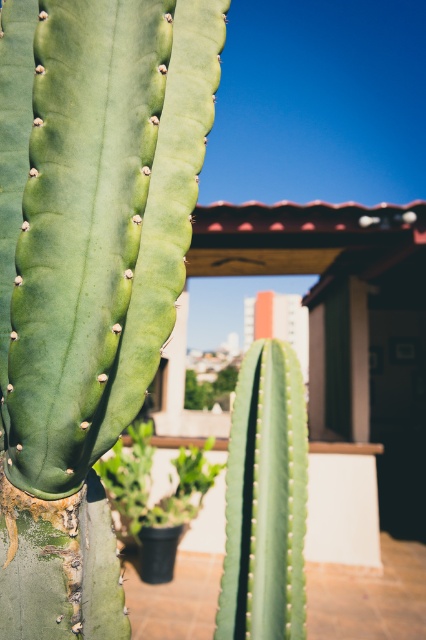
Question: Can you confirm if green rough cactus at center is bigger than green matte cactus at center?

Choices:
 (A) yes
 (B) no

Answer: (A)

Question: Is green rough cactus at center to the right of green matte cactus at center from the viewer's perspective?

Choices:
 (A) no
 (B) yes

Answer: (A)

Question: Which of the following is the closest to the observer?

Choices:
 (A) green matte cactus at center
 (B) green rough cactus at center

Answer: (B)

Question: Does green rough cactus at center lie in front of green matte cactus at center?

Choices:
 (A) yes
 (B) no

Answer: (A)

Question: Which point is closer to the camera?

Choices:
 (A) green matte cactus at center
 (B) green rough cactus at center

Answer: (B)